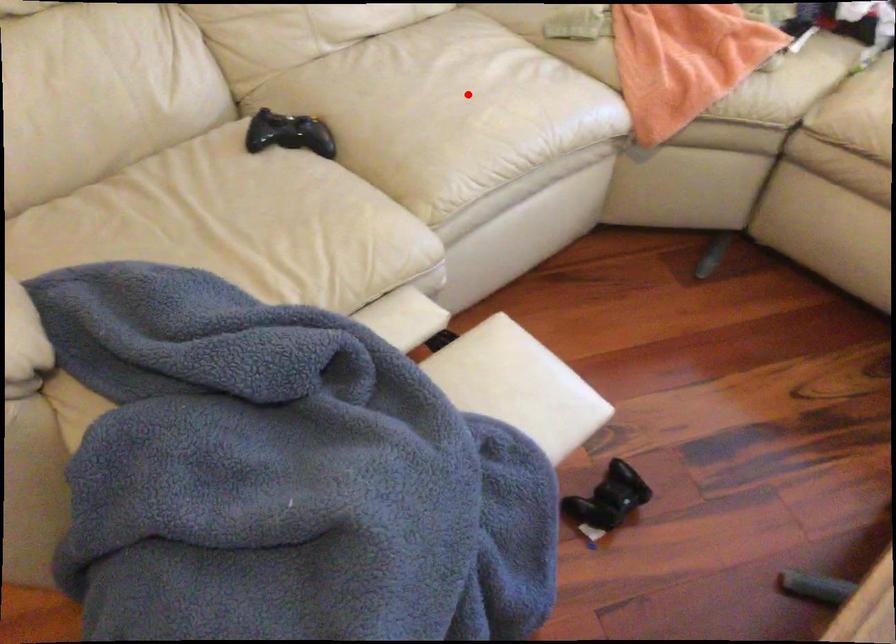
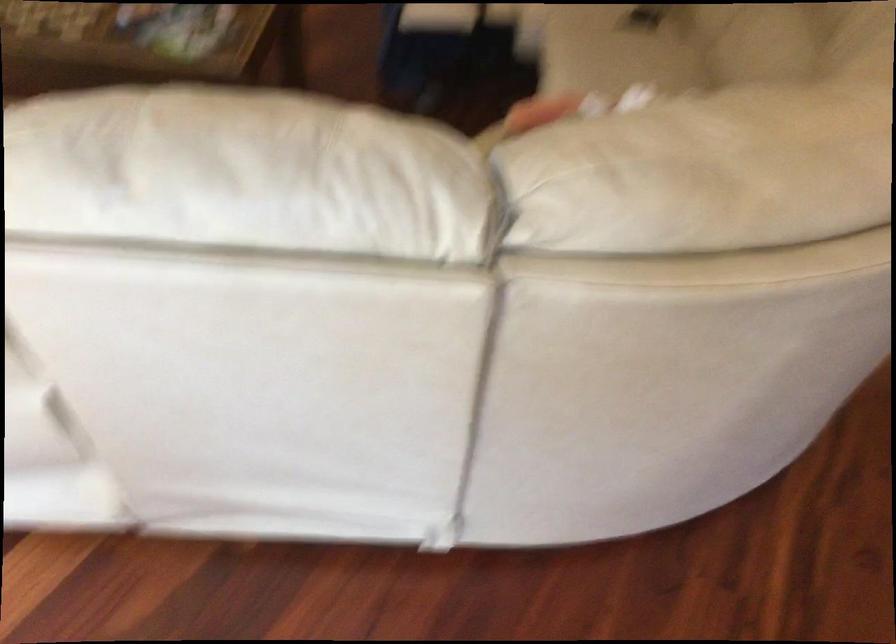
In the second image, find the point that corresponds to the highlighted location in the first image.

(616, 49)